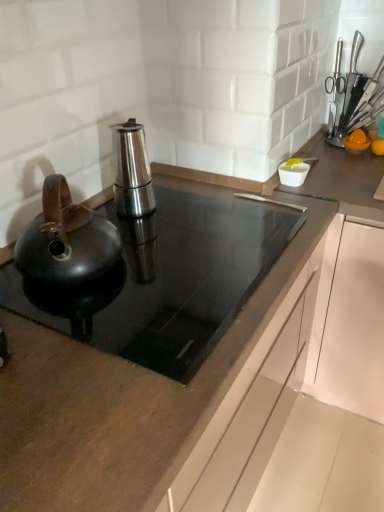
Identify the location of free space in front of stainless steel espresso maker at center, which is the 1th kitchen appliance in back-to-front order. (162, 236).